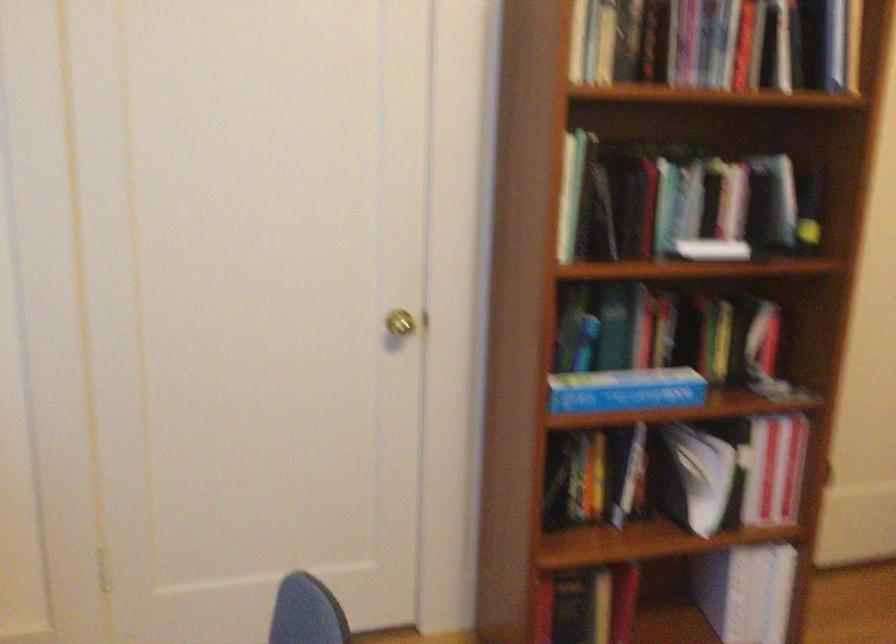
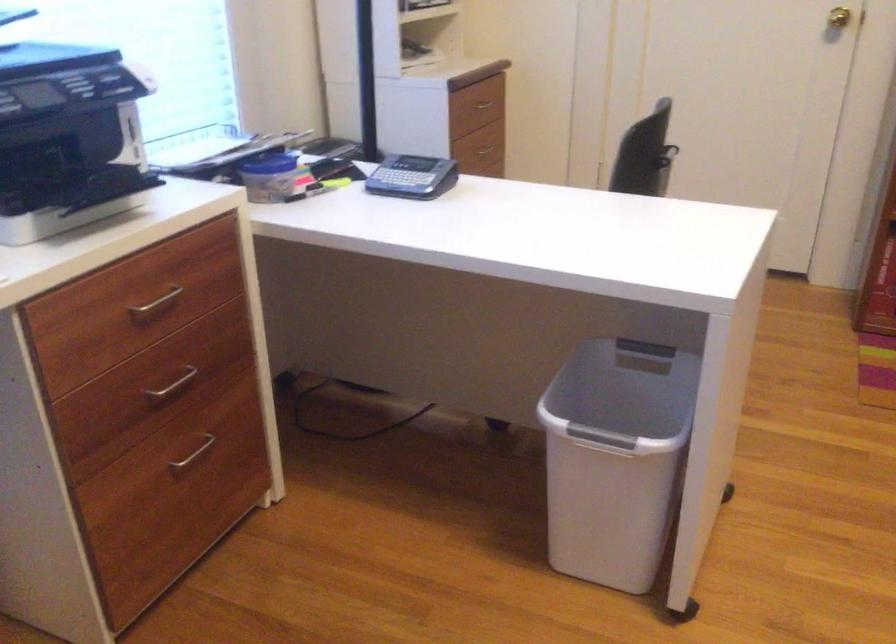
Where in the second image is the point corresponding to point (410, 301) from the first image?

(839, 17)